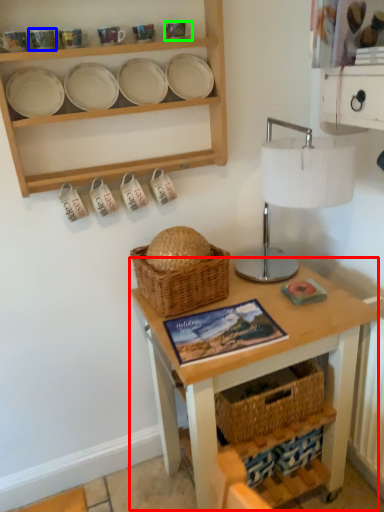
Question: Estimate the real-world distances between objects in this image. Which object is closer to table (highlighted by a red box), tableware (highlighted by a blue box) or tableware (highlighted by a green box)?

Choices:
 (A) tableware
 (B) tableware

Answer: (B)